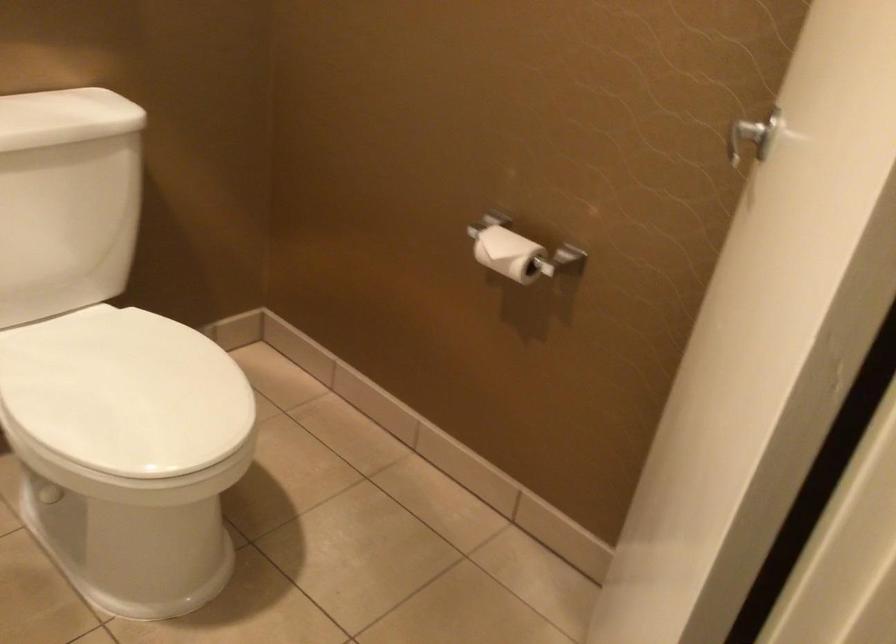
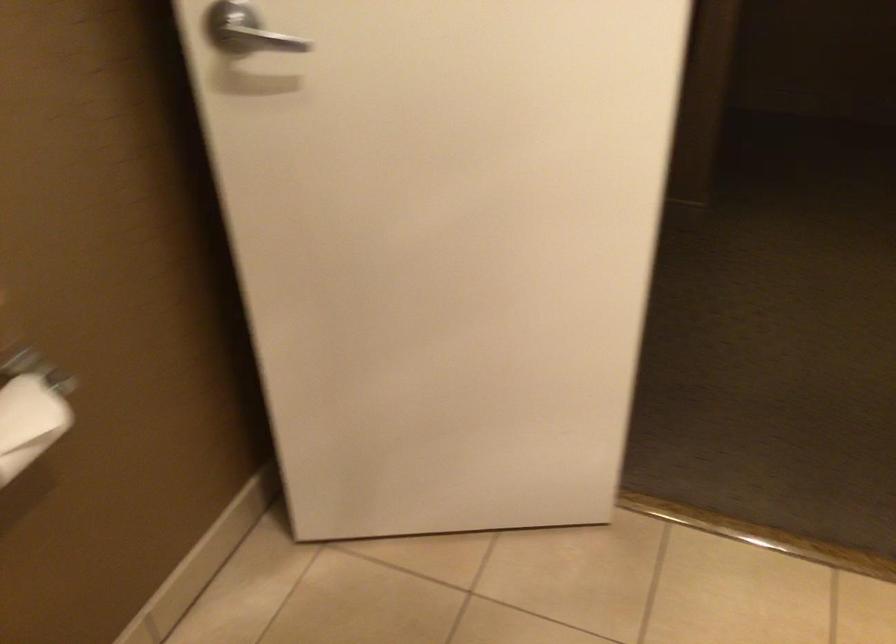
Locate, in the second image, the point that corresponds to point 722,174 in the first image.

(257, 39)